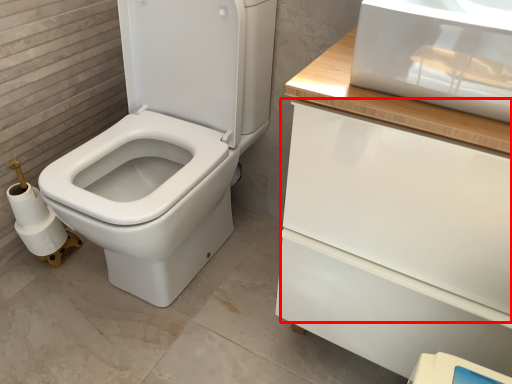
Question: From the image's perspective, what is the correct spatial relationship of drawer (annotated by the red box) in relation to toilet paper?

Choices:
 (A) above
 (B) below

Answer: (A)